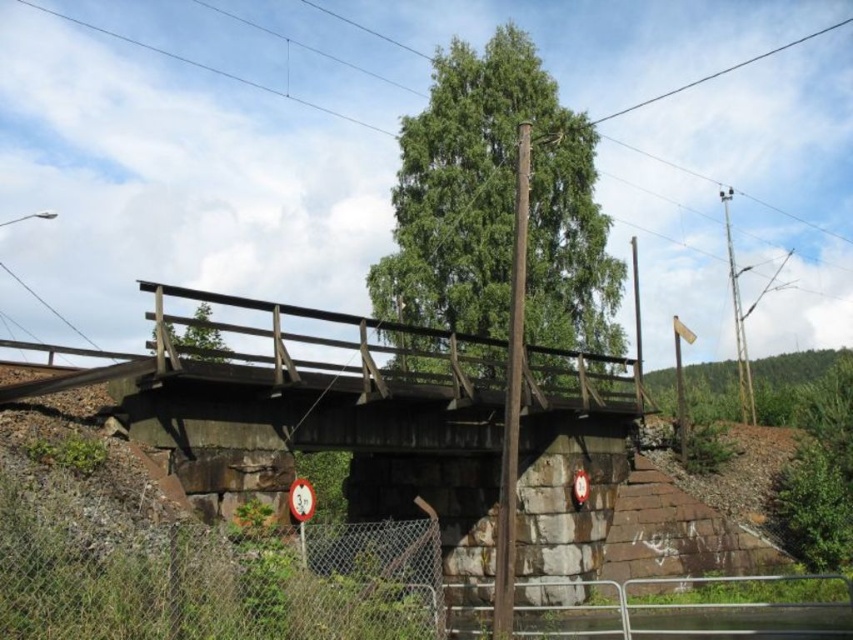
Question: Which of the following is the farthest from the observer?

Choices:
 (A) 728,68
 (B) 436,131

Answer: (A)

Question: Can you confirm if green leafy tree at center is bigger than green matte tree at center?

Choices:
 (A) yes
 (B) no

Answer: (A)

Question: From the image, what is the correct spatial relationship of green leafy tree at center in relation to black wire at upper center?

Choices:
 (A) above
 (B) below

Answer: (B)

Question: Which of the following is the farthest from the observer?

Choices:
 (A) green leafy tree at center
 (B) green matte tree at center
 (C) black wire at upper center

Answer: (C)

Question: Estimate the real-world distances between objects in this image. Which object is farther from the green leafy tree at center?

Choices:
 (A) black wire at upper center
 (B) green matte tree at center

Answer: (A)

Question: Can you confirm if green leafy tree at center is positioned above green matte tree at center?

Choices:
 (A) yes
 (B) no

Answer: (A)